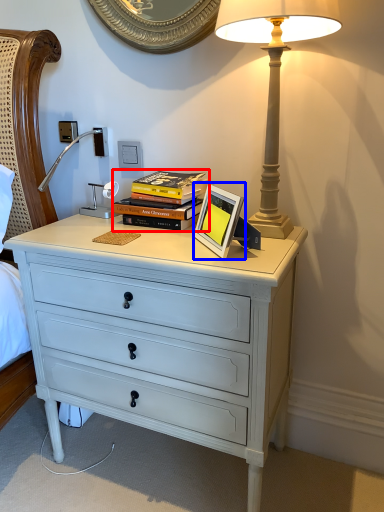
Question: Which point is closer to the camera, book (highlighted by a red box) or picture frame (highlighted by a blue box)?

Choices:
 (A) book
 (B) picture frame

Answer: (B)